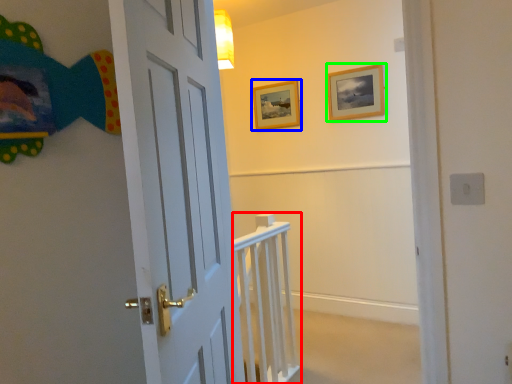
Question: Which is farther away from rail (highlighted by a red box)? picture frame (highlighted by a blue box) or picture frame (highlighted by a green box)?

Choices:
 (A) picture frame
 (B) picture frame

Answer: (A)